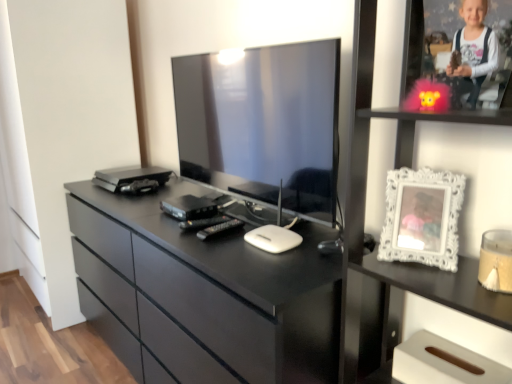
At what (x,y) coordinates should I click in order to perform the action: click on free point to the left of satin black device at center. Please return your answer as a coordinate pair (x, y). The height and width of the screenshot is (384, 512). Looking at the image, I should click on (144, 213).